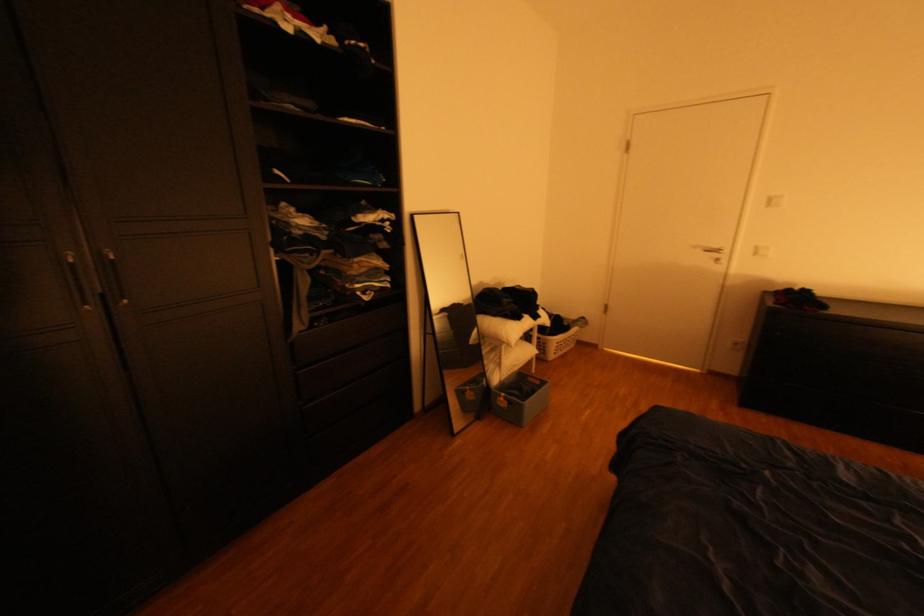
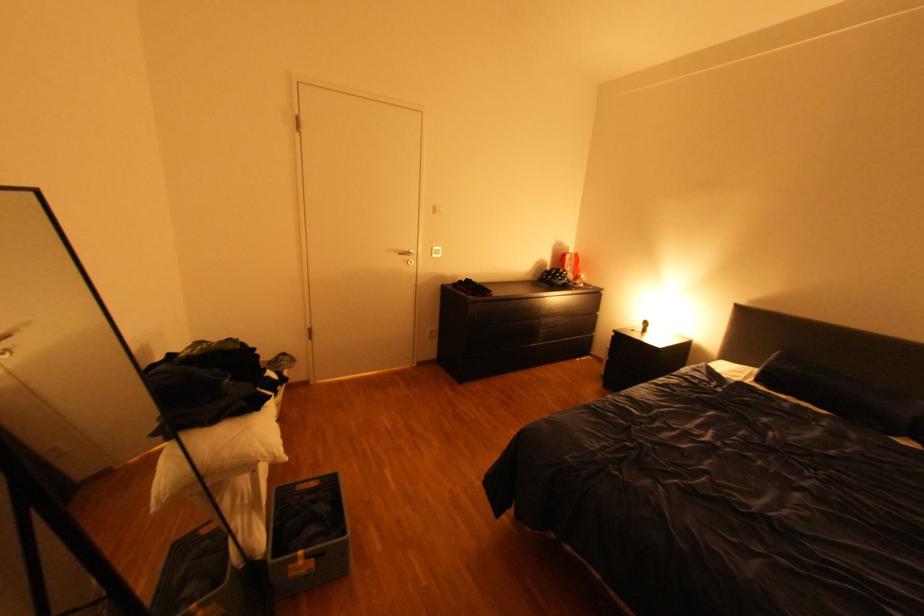
In the second image, find the point that corresponds to (x=541, y=379) in the first image.

(310, 488)